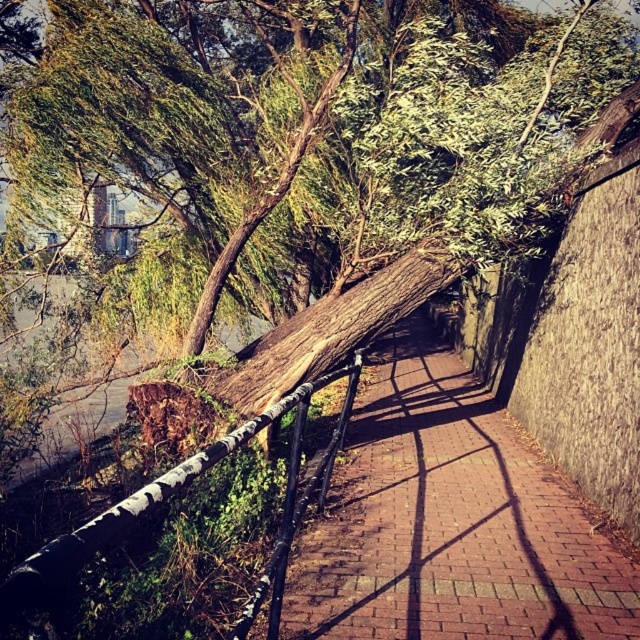
Who is more distant from viewer, (372,634) or (196,460)?

Point (372,634)

Is brick pavement at center below white painted metal rail at center?

Yes.

This screenshot has height=640, width=640. Find the location of `brick pavement at center`. brick pavement at center is located at coordinates (449, 522).